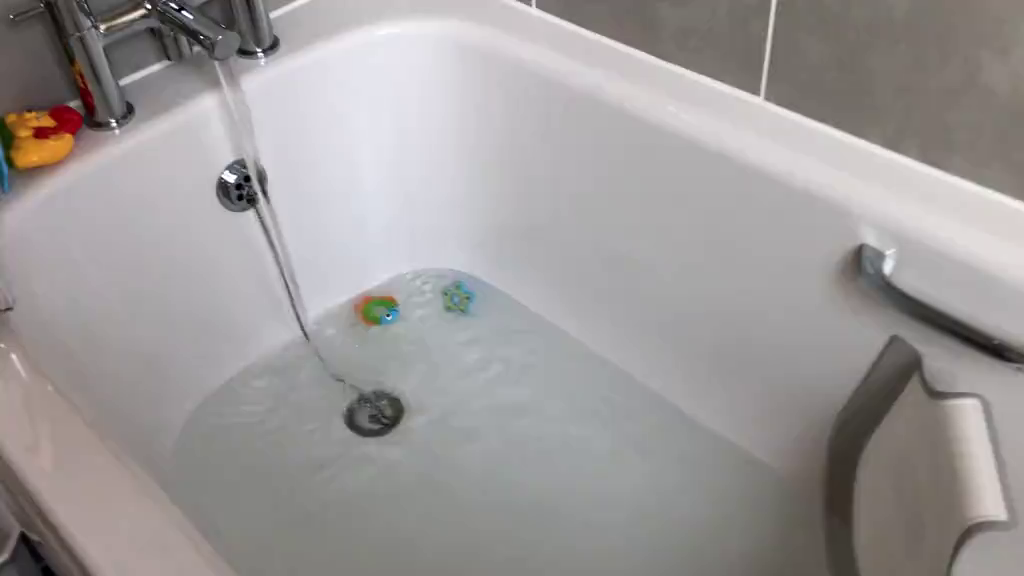
Image resolution: width=1024 pixels, height=576 pixels. Find the location of `silver bathtub fixtures`. silver bathtub fixtures is located at coordinates (88, 44), (243, 183), (380, 420), (870, 262).